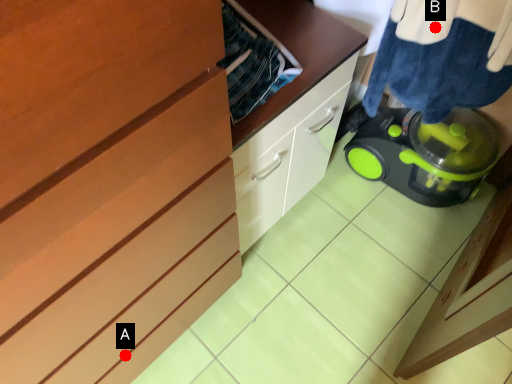
Question: Two points are circled on the image, labeled by A and B beside each circle. Which of the following is the closest to the observer?

Choices:
 (A) A is closer
 (B) B is closer

Answer: (B)